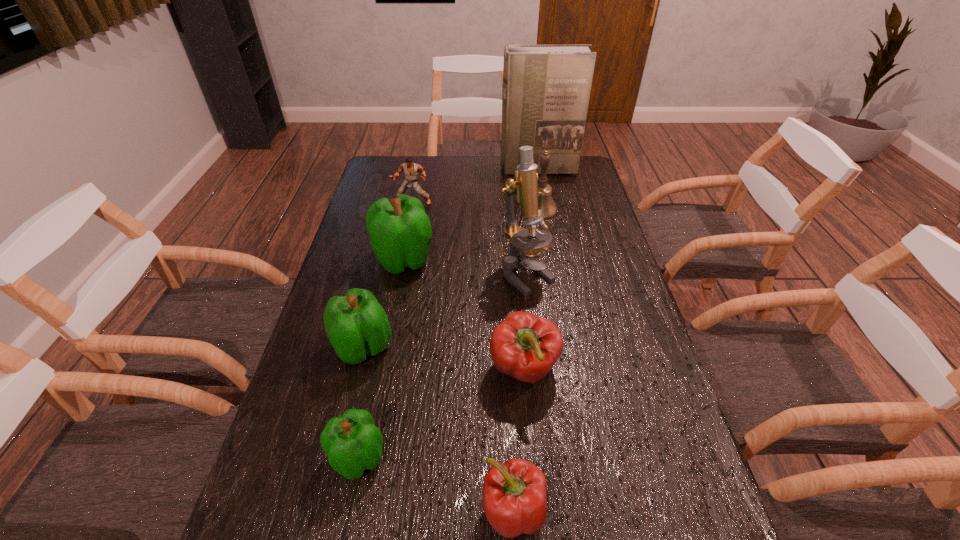
Where is `the farthest object`? the farthest object is located at coordinates (546, 88).

Image resolution: width=960 pixels, height=540 pixels. What are the coordinates of `microscope` in the screenshot? It's located at (524, 248).

Where is `bell`? bell is located at coordinates (547, 208).

Locate an element on the screen. This screenshot has height=540, width=960. the tallest bell pepper is located at coordinates (400, 232).

Locate an element on the screen. the farthest bell pepper is located at coordinates (400, 232).

Locate an element on the screen. puncher is located at coordinates (411, 170).

The height and width of the screenshot is (540, 960). I want to click on the second nearest green bell pepper, so click(x=356, y=324).

You are a GUI agent. You are given a task and a screenshot of the screen. Output one action in this format:
    pyautogui.click(x=<x>, y=<y>)
    Task: Click on the bigger pink bell pepper
    
    Given the screenshot: What is the action you would take?
    pyautogui.click(x=524, y=346)

This screenshot has width=960, height=540. Identify the location of the nearest green bell pepper. (352, 442).

Find the location of a particular element. vacant space positioned on the cover of the farthest object is located at coordinates (546, 213).